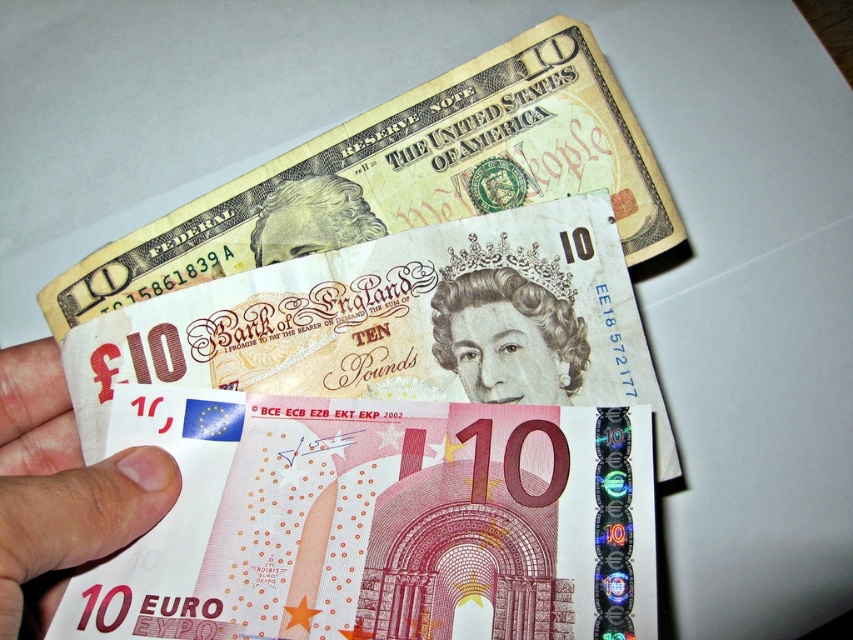
Is smooth paper banknote at upper center bigger than smooth paper portrait at center?

Indeed, smooth paper banknote at upper center has a larger size compared to smooth paper portrait at center.

Who is lower down, smooth paper banknote at upper center or smooth paper portrait at center?

smooth paper portrait at center is lower down.

Find the location of `smooth paper banknote at upper center`. smooth paper banknote at upper center is located at coordinates (405, 176).

The height and width of the screenshot is (640, 853). What do you see at coordinates (405, 176) in the screenshot?
I see `smooth paper banknote at upper center` at bounding box center [405, 176].

Which is in front, point (416, 224) or point (341, 216)?

Positioned in front is point (341, 216).

Where is `smooth paper banknote at upper center`? smooth paper banknote at upper center is located at coordinates (405, 176).

Can you confirm if smooth paper portrait at center is thinner than matte yellow paper at upper center?

Correct, smooth paper portrait at center's width is less than matte yellow paper at upper center's.

Is smooth paper portrait at center bigger than matte yellow paper at upper center?

Correct, smooth paper portrait at center is larger in size than matte yellow paper at upper center.

Which is behind, point (572, 317) or point (257, 216)?

The point (257, 216) is more distant.

The image size is (853, 640). Find the location of `smooth paper portrait at center`. smooth paper portrait at center is located at coordinates (508, 337).